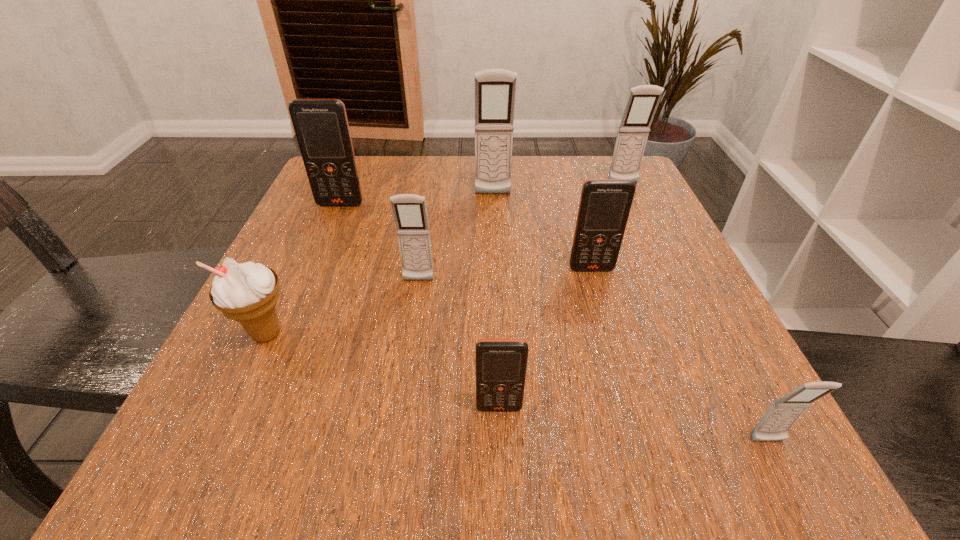
Find the location of a particular element. This screenshot has width=960, height=540. free region located 0.060m on the screen of the third cellular telephone from right to left is located at coordinates (599, 296).

Where is `vacant area situated 0.100m on the back of the icecream`? Image resolution: width=960 pixels, height=540 pixels. vacant area situated 0.100m on the back of the icecream is located at coordinates (296, 272).

Find the location of a particular element. This screenshot has width=960, height=540. vacant position located on the screen of the second orange cellular telephone from left to right is located at coordinates (502, 483).

Find the location of a particular element. object present at the near edge is located at coordinates (774, 425).

Image resolution: width=960 pixels, height=540 pixels. I want to click on cellular telephone that is positioned at the left edge, so click(321, 126).

In order to click on icecream present at the left edge in this screenshot , I will do [x=248, y=293].

This screenshot has height=540, width=960. Find the location of `object at the far left corner`. object at the far left corner is located at coordinates (321, 126).

The height and width of the screenshot is (540, 960). I want to click on object at the far right corner, so click(x=643, y=100).

Identify the location of object at the near right corner. (774, 425).

Identify the location of blank space at the far edge of the desktop. The width and height of the screenshot is (960, 540). (557, 174).